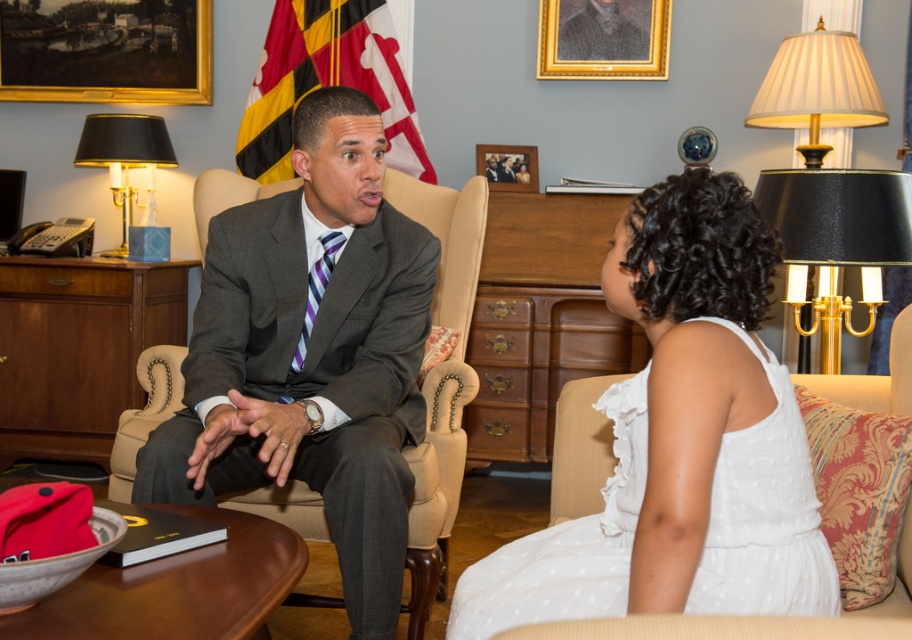
You are organizing a charity event and need to arrange seating for two guests. The guest wearing the white dotted dress at center requires a chair that can accommodate a minimum width of 40 cm. The guest in the matte gray suit at center needs a chair with a minimum width of 50 cm. Based on the image, can both guests be seated comfortably?

The white dotted dress at center has a width less than the matte gray suit at center, which suggests the guest in the white dotted dress at center requires a narrower chair. Since the matte gray suit at center requires a 50 cm chair, the white dotted dress at center guest can use a chair as narrow as 40 cm. Therefore, both guests can be accommodated with chairs of appropriate widths.